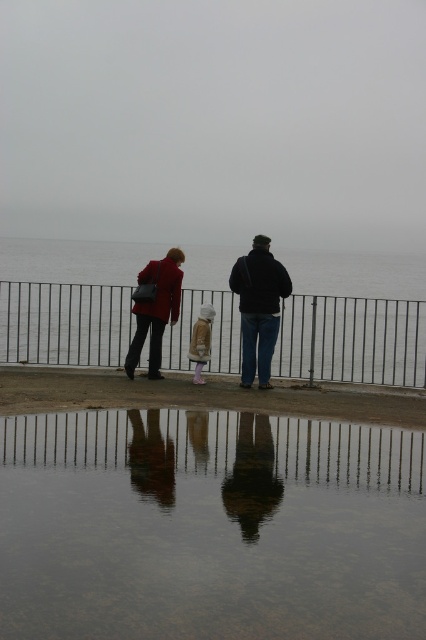
You are standing at the edge of the water and want to walk towards the point labeled as point (255, 323). However, there is an obstacle at point (126, 385). Can you walk around the obstacle to reach your destination?

Point (126, 385) is closer to the viewer than point (255, 323). Therefore, the obstacle at point (126, 385) is in front of your destination, so you can walk around it to reach point (255, 323).

Based on the photo, based on the coordinates provided, what is located at point (259, 307) in the image?

The point (259, 307) indicates dark blue jeans at center.

You are a photographer trying to capture a reflection of the black metal fence at center and dark blue jeans at center in the puddle. Which object will have a more distorted reflection?

The black metal fence at center is shorter than dark blue jeans at center, so its reflection in the puddle will be more distorted because shorter objects closer to the water surface tend to have more distorted reflections.